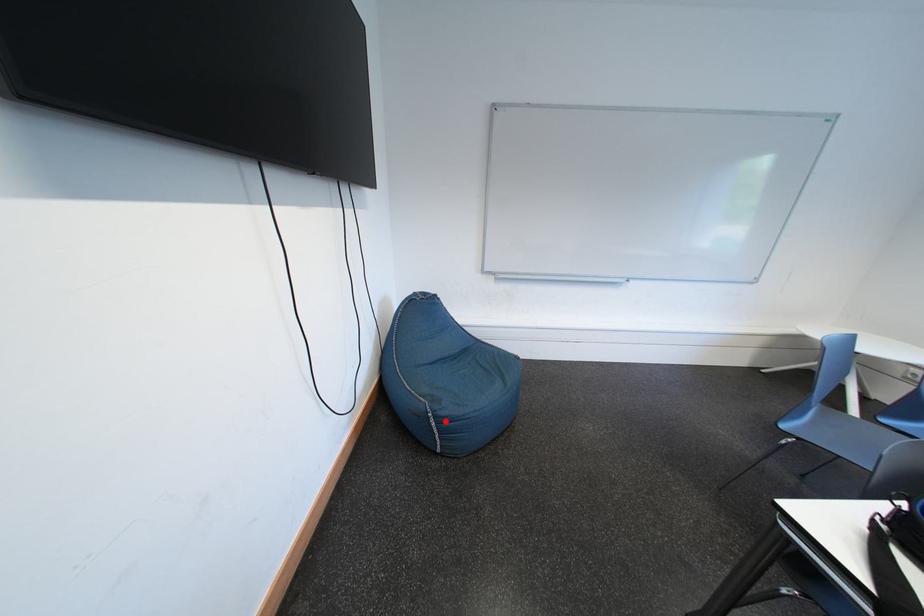
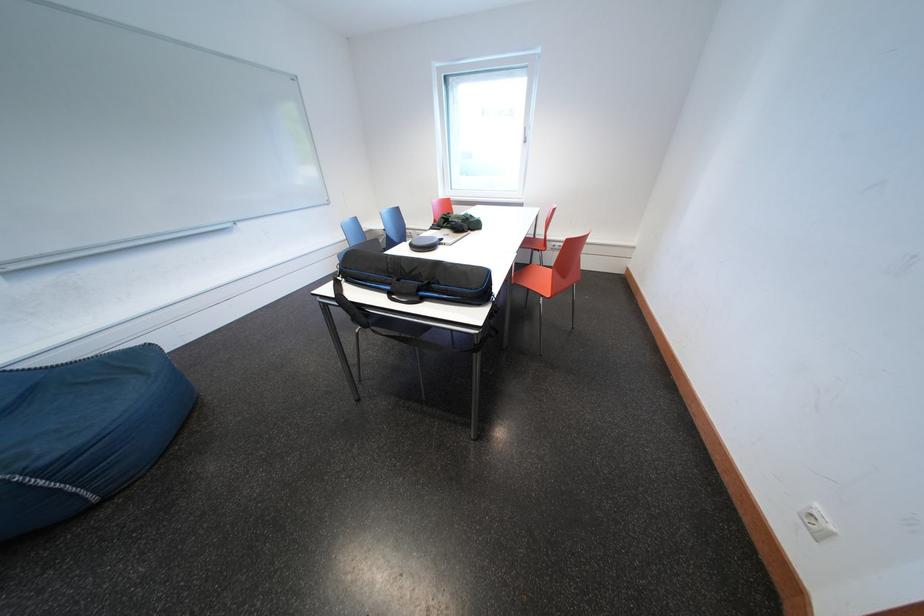
Locate, in the second image, the point that corresponds to the highlighted location in the first image.

(46, 477)